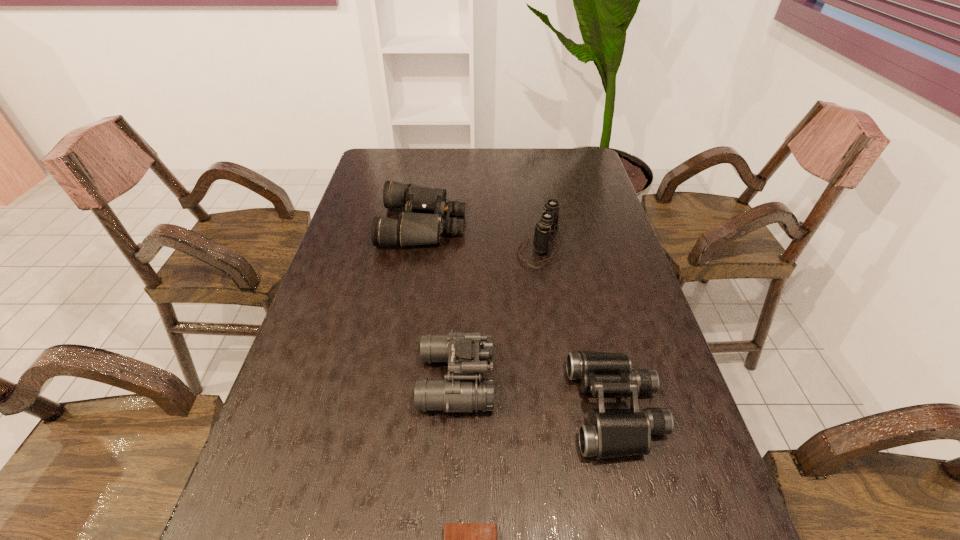
The image size is (960, 540). I want to click on object present at the left edge, so click(422, 223).

Locate an element on the screen. object that is at the right edge is located at coordinates (609, 433).

This screenshot has width=960, height=540. Identify the location of free space at the far edge of the desktop. (442, 176).

At what (x,y) coordinates should I click in order to perform the action: click on free location at the left edge. Please return your answer as a coordinate pair (x, y). Looking at the image, I should click on (265, 457).

You are a GUI agent. You are given a task and a screenshot of the screen. Output one action in this format:
    pyautogui.click(x=<x>, y=<y>)
    Task: Click on the free space at the right edge of the desktop
    The image size is (960, 540).
    Given the screenshot: What is the action you would take?
    pyautogui.click(x=593, y=231)

Find the location of `vacant point at the far left corner`. vacant point at the far left corner is located at coordinates (407, 153).

Where is `free space at the far right corner`? free space at the far right corner is located at coordinates (557, 173).

At what (x,y) coordinates should I click in order to perform the action: click on object that can be found as the closest to the nearest object. Please return your answer as a coordinate pair (x, y). This screenshot has width=960, height=540. Looking at the image, I should click on (467, 354).

Select which object is the closest to the nearest object. Please provide its 2D coordinates. Your answer should be formatted as a tuple, i.e. [(x, y)], where the tuple contains the x and y coordinates of a point satisfying the conditions above.

[(467, 354)]

You are a GUI agent. You are given a task and a screenshot of the screen. Output one action in this format:
    pyautogui.click(x=<x>, y=<y>)
    Task: Click on the binoculars that stands as the third closest to the nearest object
    The width and height of the screenshot is (960, 540).
    Given the screenshot: What is the action you would take?
    pyautogui.click(x=549, y=222)